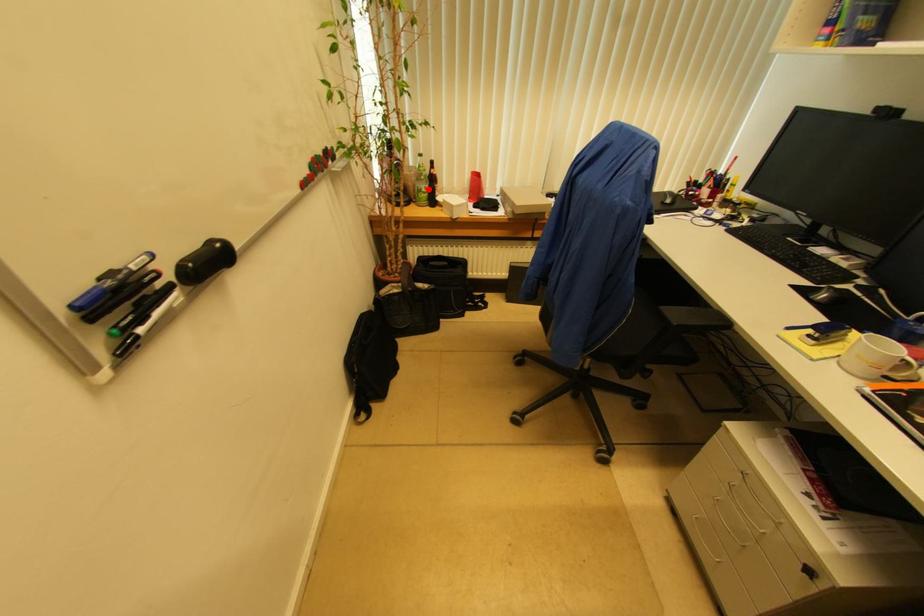
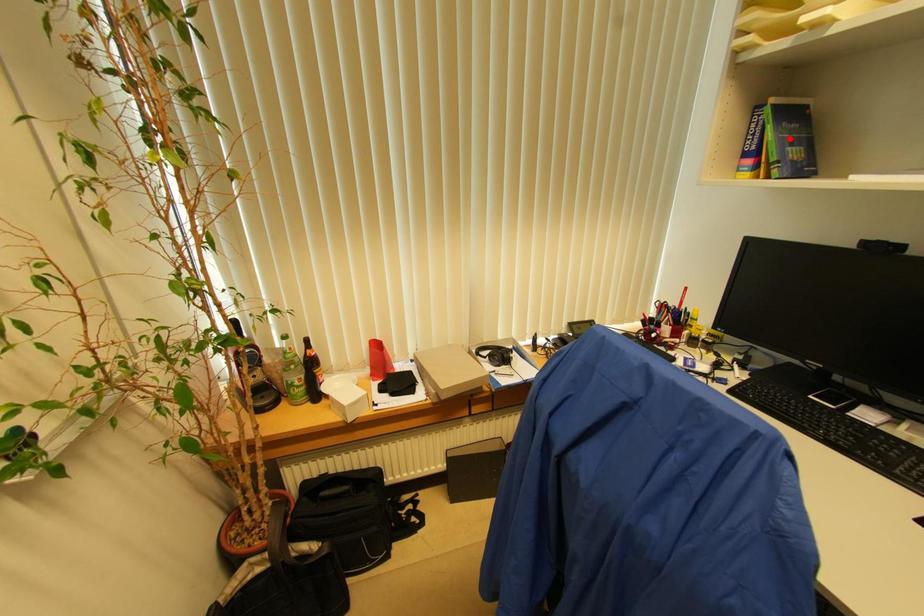
I am providing you with two images of the same scene from different viewpoints. A red point is marked on the first image and another point is marked on the second image. Is the red point in image1 aligned with the point shown in image2?

No